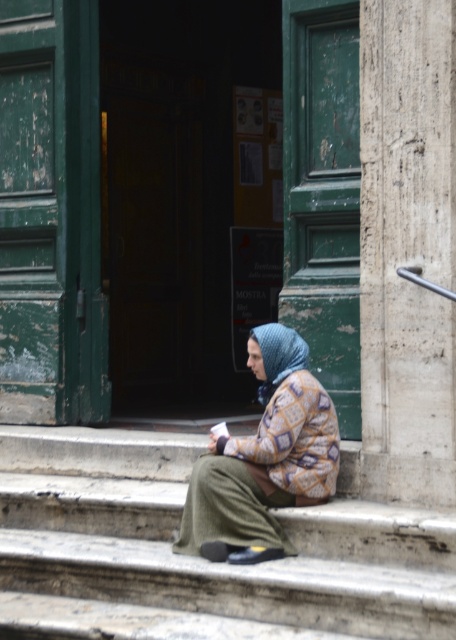
You are a delivery person carrying a box that is 2 feet wide. You need to walk up the stone steps at center while avoiding the knitted woolen scarf at center. Can you fit through the space between the steps and the scarf?

The stone steps at center might be wider than knitted woolen scarf at center, so there might be enough space for the delivery person to fit through with their 2 feet wide box.

You are a delivery person trying to place a small package on the stone steps at center without covering the knitted woolen scarf at center. Is this possible given their sizes?

The stone steps at center has a larger size compared to knitted woolen scarf at center, so yes, the delivery person can place the package on the stone steps at center without covering the scarf.